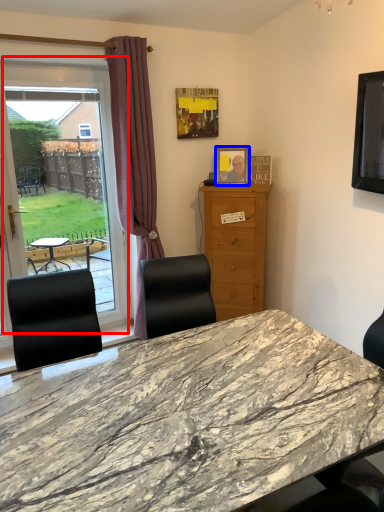
Question: Which point is further to the camera, window (highlighted by a red box) or picture frame (highlighted by a blue box)?

Choices:
 (A) window
 (B) picture frame

Answer: (B)